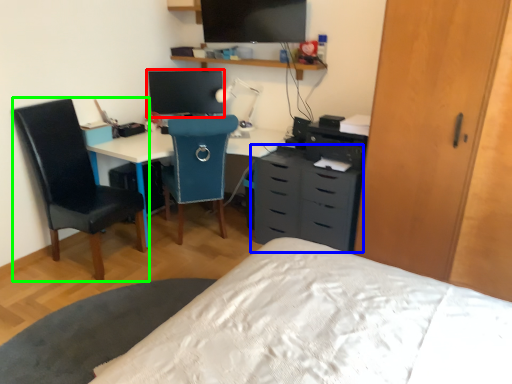
Question: Which is nearer to the computer monitor (highlighted by a red box)? chest of drawers (highlighted by a blue box) or chair (highlighted by a green box).

Choices:
 (A) chest of drawers
 (B) chair

Answer: (B)